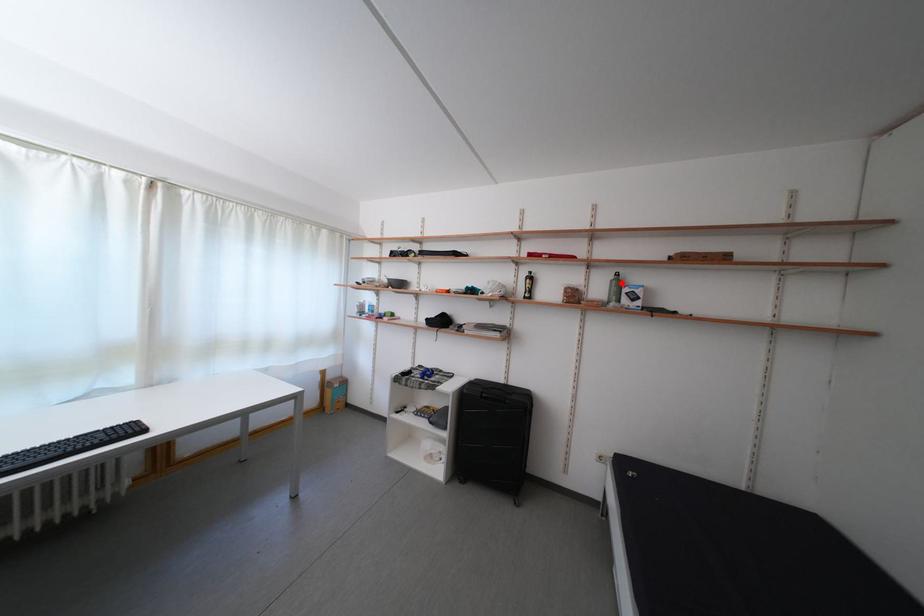
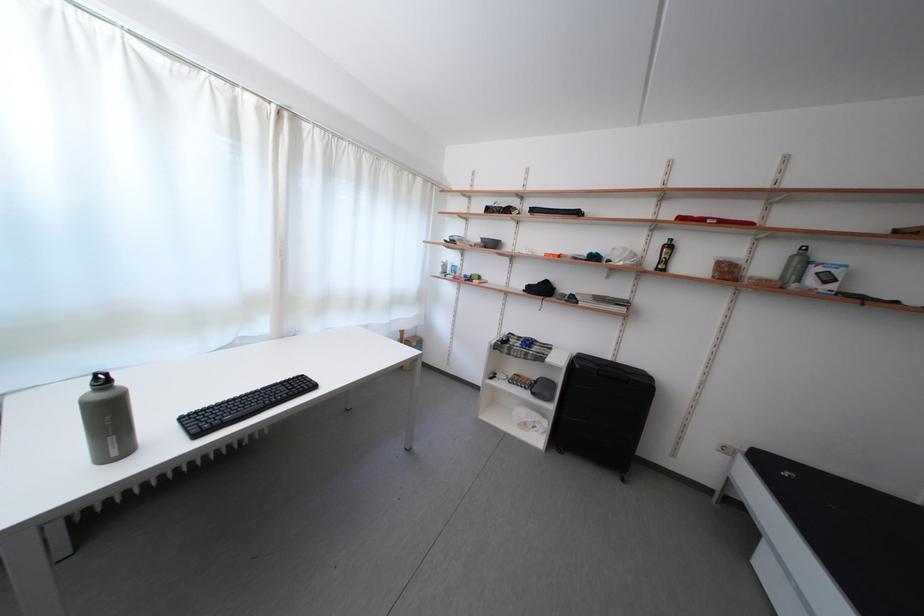
Where in the second image is the point corresponding to the highlighted location from the first image?

(804, 257)